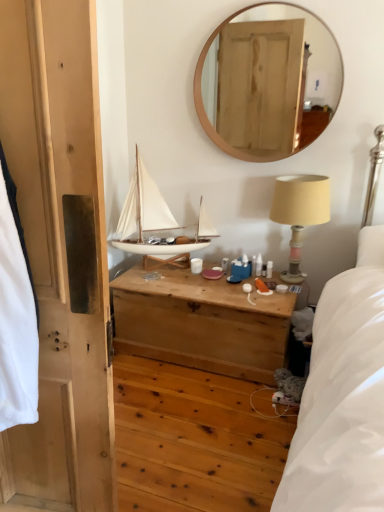
Question: From the image's perspective, would you say wooden chest at center is shown under white matte sailboat at center?

Choices:
 (A) yes
 (B) no

Answer: (A)

Question: Considering the relative sizes of wooden chest at center and white matte sailboat at center in the image provided, is wooden chest at center shorter than white matte sailboat at center?

Choices:
 (A) yes
 (B) no

Answer: (A)

Question: Are wooden chest at center and white matte sailboat at center far apart?

Choices:
 (A) yes
 (B) no

Answer: (B)

Question: From a real-world perspective, is wooden chest at center physically below white matte sailboat at center?

Choices:
 (A) no
 (B) yes

Answer: (B)

Question: Does wooden chest at center have a smaller size compared to white matte sailboat at center?

Choices:
 (A) no
 (B) yes

Answer: (A)

Question: Considering the relative positions of wooden chest at center and white matte sailboat at center in the image provided, is wooden chest at center behind white matte sailboat at center?

Choices:
 (A) no
 (B) yes

Answer: (A)

Question: From the image's perspective, is white matte sailboat at center beneath beige fabric-covered lampshade at upper right?

Choices:
 (A) yes
 (B) no

Answer: (B)

Question: Can you confirm if white matte sailboat at center is shorter than beige fabric-covered lampshade at upper right?

Choices:
 (A) yes
 (B) no

Answer: (B)

Question: Is white matte sailboat at center positioned behind beige fabric-covered lampshade at upper right?

Choices:
 (A) no
 (B) yes

Answer: (B)

Question: Is white matte sailboat at center bigger than beige fabric-covered lampshade at upper right?

Choices:
 (A) no
 (B) yes

Answer: (B)

Question: Does white matte sailboat at center touch beige fabric-covered lampshade at upper right?

Choices:
 (A) no
 (B) yes

Answer: (A)

Question: From a real-world perspective, is white matte sailboat at center on beige fabric-covered lampshade at upper right?

Choices:
 (A) yes
 (B) no

Answer: (A)

Question: From the image's perspective, does wooden chest at center appear higher than wooden mirror at upper center?

Choices:
 (A) yes
 (B) no

Answer: (B)